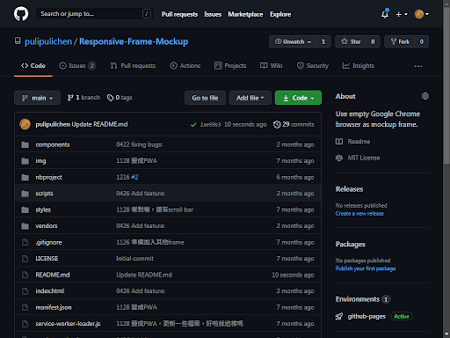
You are a GUI agent. You are given a task and a screenshot of the screen. Output one action in this format:
    pyautogui.click(x=<x>, y=<y>)
    Task: Click on the folders
    This screenshot has width=450, height=338.
    Given the screenshot: What is the action you would take?
    pyautogui.click(x=27, y=144), pyautogui.click(x=26, y=156), pyautogui.click(x=26, y=174), pyautogui.click(x=26, y=194), pyautogui.click(x=26, y=210), pyautogui.click(x=26, y=226)